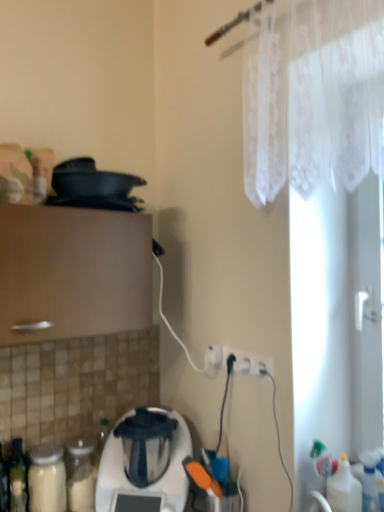
Question: Which direction should I rotate to look at white plastic electric outlet at lower center?

Choices:
 (A) right
 (B) left

Answer: (A)

Question: Can you confirm if white plastic electric outlet at lower center is positioned to the left of white plastic blender at lower center?

Choices:
 (A) yes
 (B) no

Answer: (B)

Question: Is white plastic electric outlet at lower center oriented away from white plastic blender at lower center?

Choices:
 (A) yes
 (B) no

Answer: (B)

Question: Can white plastic blender at lower center be found inside white plastic electric outlet at lower center?

Choices:
 (A) yes
 (B) no

Answer: (B)

Question: Could you tell me if white plastic electric outlet at lower center is turned towards white plastic blender at lower center?

Choices:
 (A) yes
 (B) no

Answer: (B)

Question: Is the depth of white plastic electric outlet at lower center greater than that of white plastic blender at lower center?

Choices:
 (A) no
 (B) yes

Answer: (B)

Question: Can you confirm if white plastic electric outlet at lower center is taller than white plastic blender at lower center?

Choices:
 (A) no
 (B) yes

Answer: (A)

Question: From a real-world perspective, is white plastic blender at lower center physically below white plastic electric outlet at lower center?

Choices:
 (A) yes
 (B) no

Answer: (A)

Question: From the image's perspective, is white plastic blender at lower center above white plastic electric outlet at lower center?

Choices:
 (A) yes
 (B) no

Answer: (B)

Question: Does white plastic blender at lower center have a greater height compared to white plastic electric outlet at lower center?

Choices:
 (A) yes
 (B) no

Answer: (A)

Question: Is white plastic blender at lower center at the right side of white plastic electric outlet at lower center?

Choices:
 (A) no
 (B) yes

Answer: (A)

Question: From the image's perspective, is white plastic blender at lower center under white plastic electric outlet at lower center?

Choices:
 (A) no
 (B) yes

Answer: (B)

Question: Is white plastic blender at lower center positioned in front of white plastic electric outlet at lower center?

Choices:
 (A) no
 (B) yes

Answer: (B)

Question: From the image's perspective, is translucent plastic bottle at lower right located above white plastic electric outlet at lower center?

Choices:
 (A) no
 (B) yes

Answer: (A)